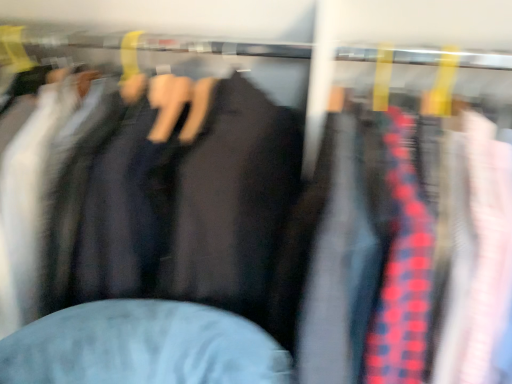
Question: Is point (196, 170) closer or farther from the camera than point (492, 344)?

Choices:
 (A) closer
 (B) farther

Answer: (B)

Question: Relative to red plaid shirt at right, is matte black jacket at center in front or behind?

Choices:
 (A) front
 (B) behind

Answer: (B)

Question: In terms of width, does matte black jacket at center look wider or thinner when compared to red plaid shirt at right?

Choices:
 (A) wide
 (B) thin

Answer: (A)

Question: Is red plaid shirt at right to the left or to the right of matte black jacket at center in the image?

Choices:
 (A) right
 (B) left

Answer: (A)

Question: Is red plaid shirt at right inside the boundaries of matte black jacket at center, or outside?

Choices:
 (A) outside
 (B) inside

Answer: (A)

Question: Is red plaid shirt at right taller or shorter than matte black jacket at center?

Choices:
 (A) tall
 (B) short

Answer: (A)

Question: Considering the positions of red plaid shirt at right and matte black jacket at center in the image, is red plaid shirt at right wider or thinner than matte black jacket at center?

Choices:
 (A) thin
 (B) wide

Answer: (A)